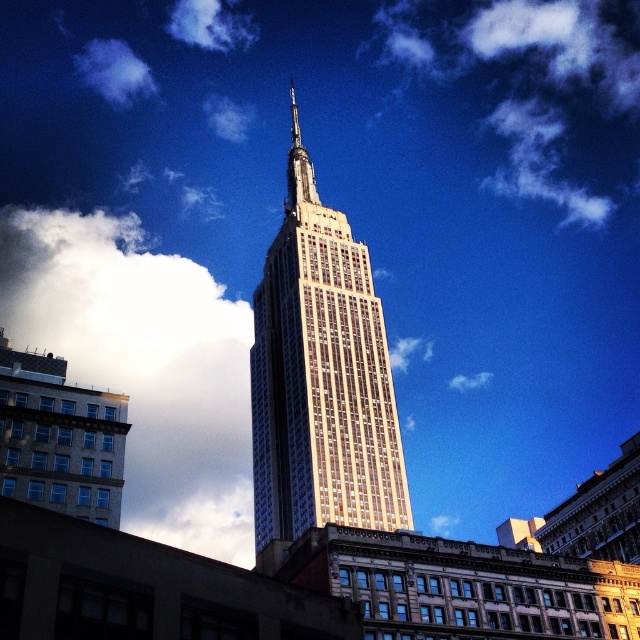
You are standing at the observation deck of the Empire State Building and want to take a photo of a specific point in the scene. The point you want to capture is labeled as point (x=342, y=508). Given that your camera has a focal length of 50mm and you are 70.55 meters away from the point, what is the approximate angle of view required to frame this point perfectly in your shot?

The point (x=342, y=508) is 70.55 meters from the camera. Using the formula for angle of view, which is 2 times arctangent of half the subject distance divided by focal length, the calculation would be 2 arctan 70.55 divided by 50. This results in an approximate angle of view of 55 degrees to capture the point effectively.

Looking at the Empire State Building scene, where is the gold glass tower at center in relation to the white fluffy cloud at upper left?

The gold glass tower at center is to the right of the white fluffy cloud at upper left.